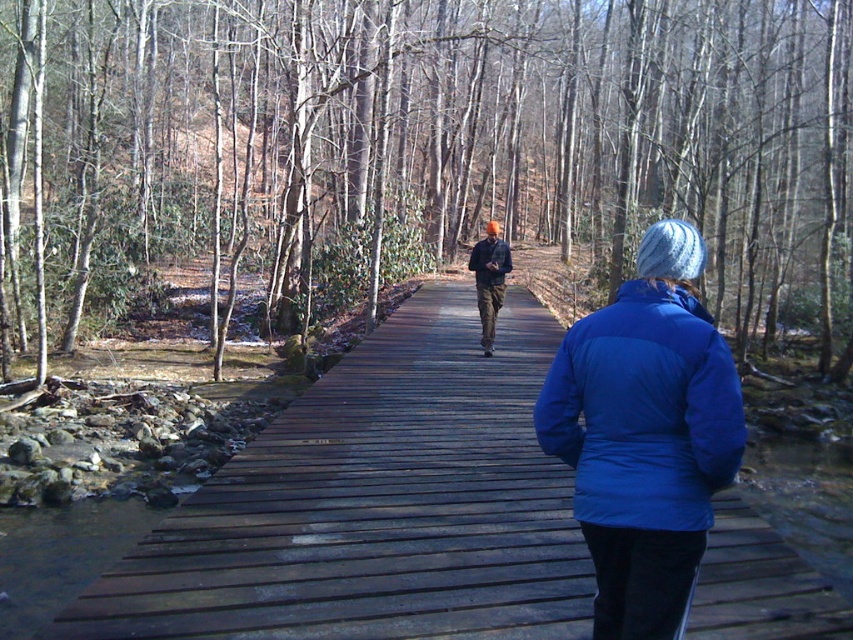
Question: Which point appears closest to the camera in this image?

Choices:
 (A) (730, 387)
 (B) (486, 413)
 (C) (80, 253)

Answer: (A)

Question: Is blue down jacket at center below dark blue jacket at center?

Choices:
 (A) no
 (B) yes

Answer: (B)

Question: Is dark brown wooden bridge at center above dark blue jacket at center?

Choices:
 (A) no
 (B) yes

Answer: (A)

Question: Estimate the real-world distances between objects in this image. Which object is closer to the orange plaid shirt at center?

Choices:
 (A) dark brown wooden bridge at center
 (B) dark blue jacket at center

Answer: (B)

Question: Which object is the closest to the orange plaid shirt at center?

Choices:
 (A) blue down jacket at center
 (B) dark blue jacket at center

Answer: (B)

Question: Is dark brown wooden bridge at center positioned before orange plaid shirt at center?

Choices:
 (A) yes
 (B) no

Answer: (A)